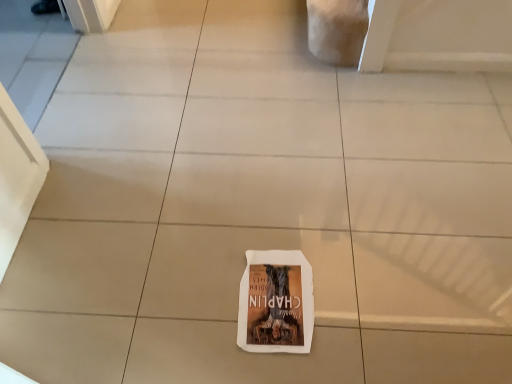
The image size is (512, 384). Identify the location of white paper flyer at center. (276, 303).

In order to face white paper flyer at center, should I rotate leftwards or rightwards?

Rotate your view right by about 2.799°.

Image resolution: width=512 pixels, height=384 pixels. Describe the element at coordinates (276, 303) in the screenshot. I see `white paper flyer at center` at that location.

Identify the location of white paper flyer at center. The image size is (512, 384). (276, 303).